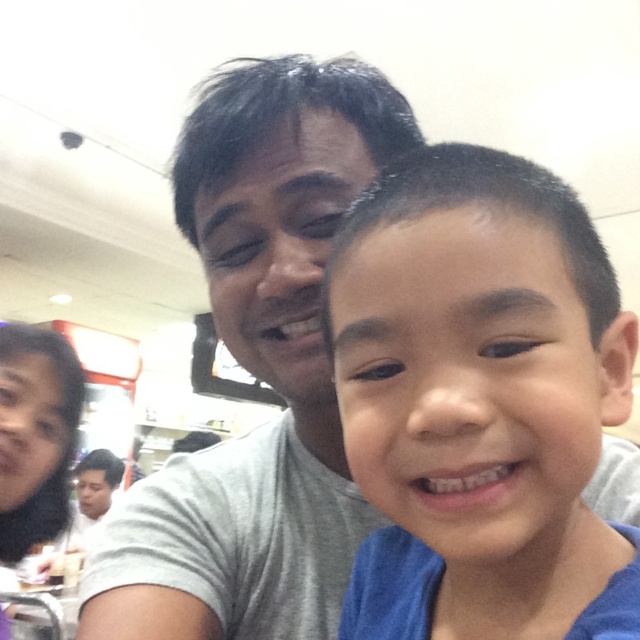
You are taking a photo of two people in a food court. You notice two points marked in the image at coordinates point (540,332) and point (326,604). Which point is closer to the camera?

Point (540,332) is closer to the camera than point (326,604).

You are a tailor who needs to determine which shirt requires more fabric for alterations. Based on the image, which shirt has a greater width between the blue cotton shirt at right and the gray cotton shirt at center?

The gray cotton shirt at center has a greater width than the blue cotton shirt at right, so it requires more fabric for alterations.

You are taking a photo of two people wearing blue cotton shirt at right and gray cotton shirt at center. Which shirt is positioned more to the right in the photo?

The blue cotton shirt at right is positioned more to the right than the gray cotton shirt at center according to the description.